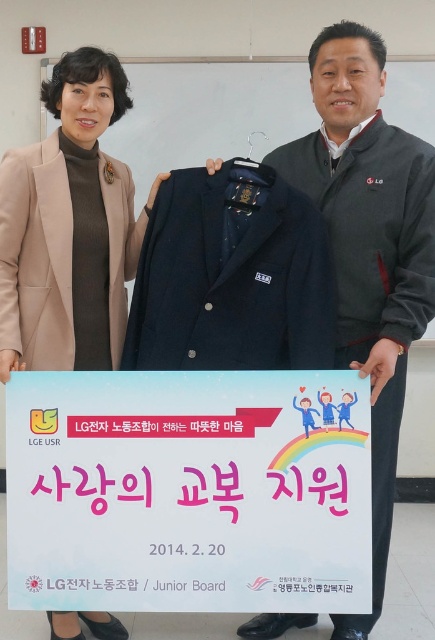
Is point (17, 557) farther from camera compared to point (42, 353)?

No, it is not.

This screenshot has width=435, height=640. I want to click on white paper sign at center, so click(188, 492).